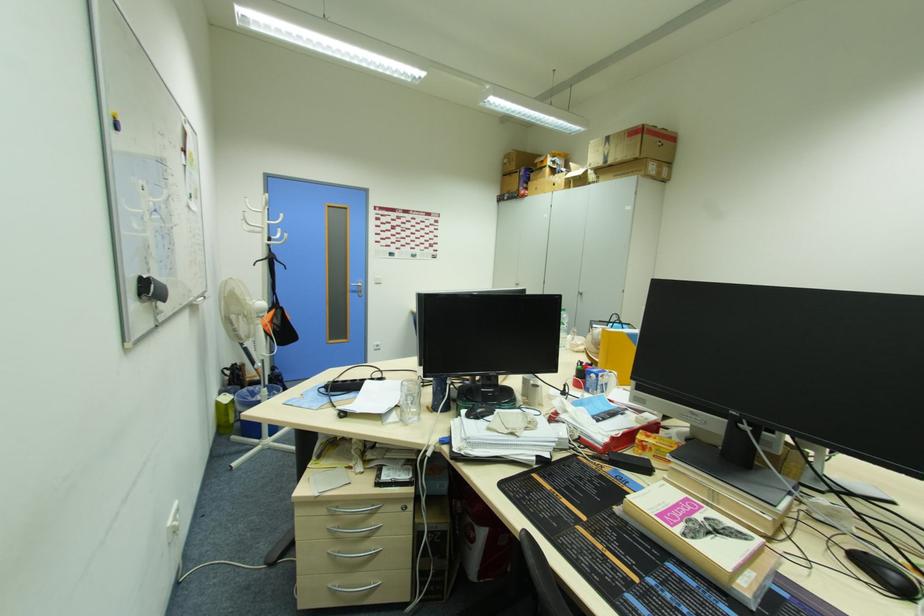
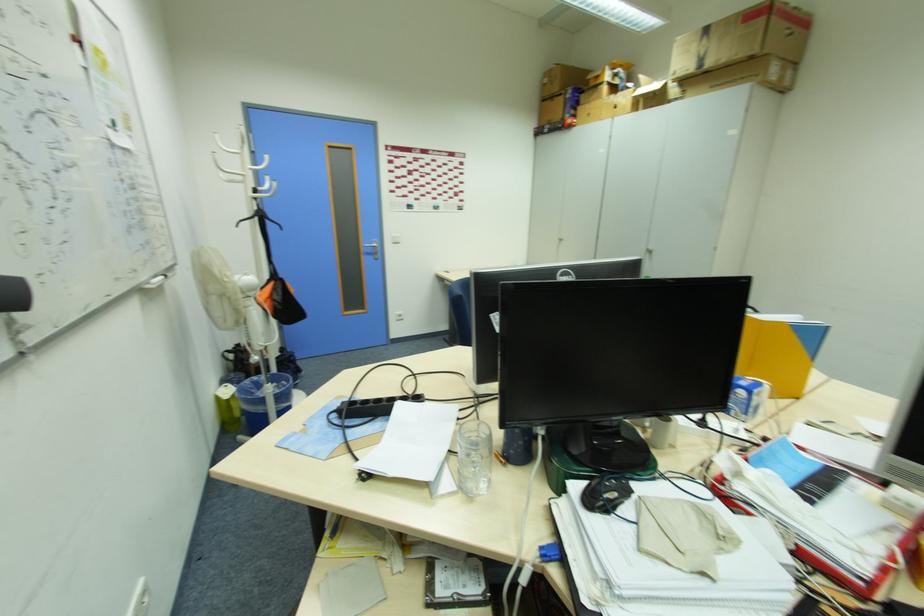
Where in the second image is the point corresponding to (222,405) from the first image?

(220, 400)